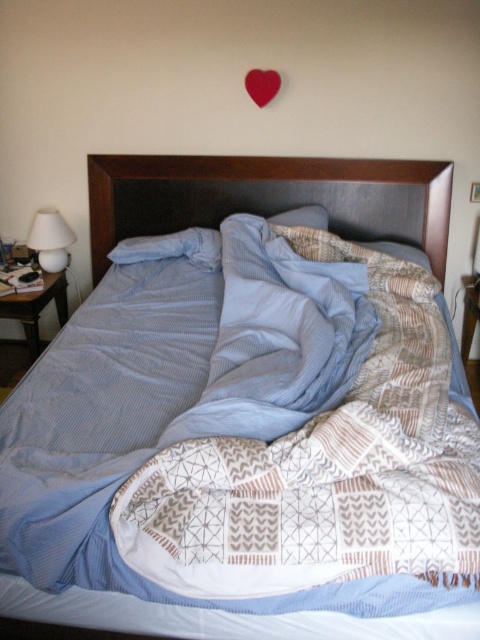
Question: Which point is farther to the camera?

Choices:
 (A) (43, 269)
 (B) (331, 170)
 (C) (255, 99)

Answer: (A)

Question: Does dark brown fabric headboard at center appear on the left side of white glossy lamp at left?

Choices:
 (A) yes
 (B) no

Answer: (B)

Question: Can you confirm if dark brown fabric headboard at center is smaller than matte red heart at upper center?

Choices:
 (A) yes
 (B) no

Answer: (B)

Question: Which is farther from the matte red heart at upper center?

Choices:
 (A) white glossy lamp at left
 (B) dark brown fabric headboard at center

Answer: (A)

Question: Which of the following is the closest to the observer?

Choices:
 (A) white glossy lamp at left
 (B) matte red heart at upper center
 (C) dark brown fabric headboard at center

Answer: (B)

Question: Is the position of white glossy lamp at left more distant than that of matte red heart at upper center?

Choices:
 (A) no
 (B) yes

Answer: (B)